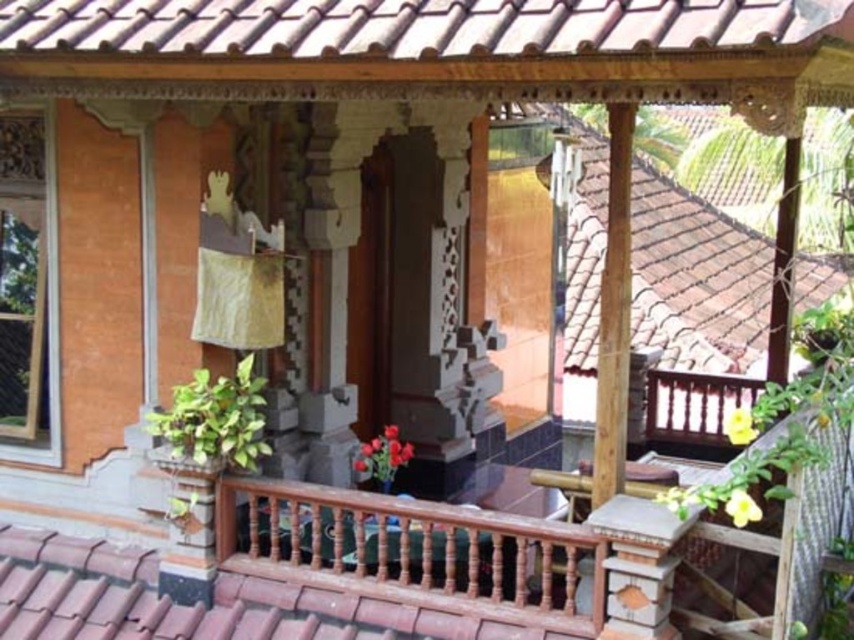
Between brown clay tiles at upper center and brown tile roof at upper right, which one is positioned lower?

brown tile roof at upper right is lower down.

Who is shorter, brown clay tiles at upper center or brown tile roof at upper right?

Standing shorter between the two is brown tile roof at upper right.

Measure the distance between brown clay tiles at upper center and camera.

brown clay tiles at upper center and camera are 3.73 meters apart from each other.

This screenshot has width=854, height=640. I want to click on brown clay tiles at upper center, so click(x=414, y=26).

Who is positioned more to the left, brown wooden balustrade at center or brown tile roof at upper right?

brown wooden balustrade at center

This screenshot has width=854, height=640. What do you see at coordinates (411, 554) in the screenshot?
I see `brown wooden balustrade at center` at bounding box center [411, 554].

Identify the location of brown wooden balustrade at center. (411, 554).

Image resolution: width=854 pixels, height=640 pixels. Find the location of `brown wooden balustrade at center`. brown wooden balustrade at center is located at coordinates (411, 554).

Is brown clay tiles at upper center above brown wooden balustrade at center?

Yes, brown clay tiles at upper center is above brown wooden balustrade at center.

Between brown clay tiles at upper center and brown wooden balustrade at center, which one has more height?

brown wooden balustrade at center is taller.

Is point (525, 44) positioned before point (512, 536)?

Yes, point (525, 44) is closer to viewer.

The width and height of the screenshot is (854, 640). I want to click on brown clay tiles at upper center, so click(414, 26).